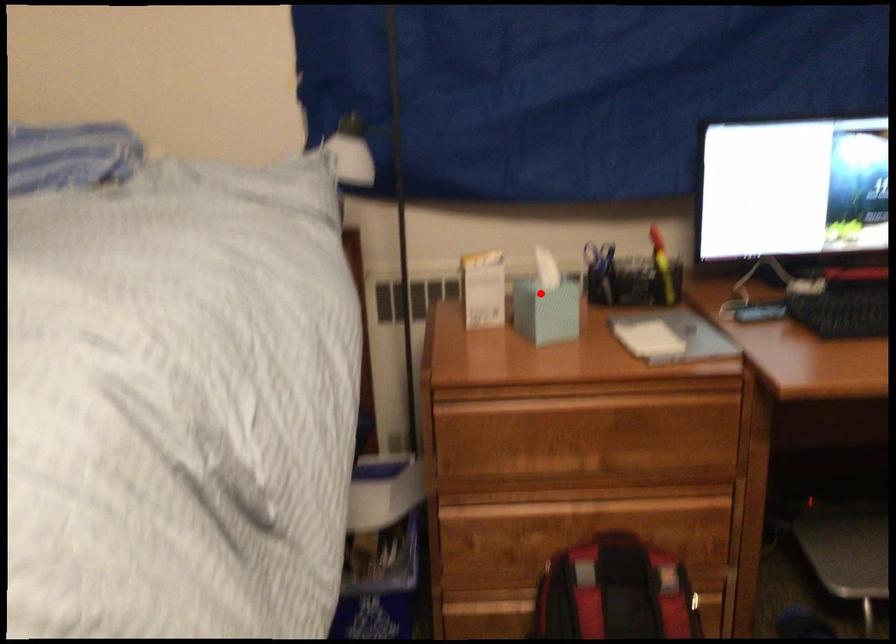
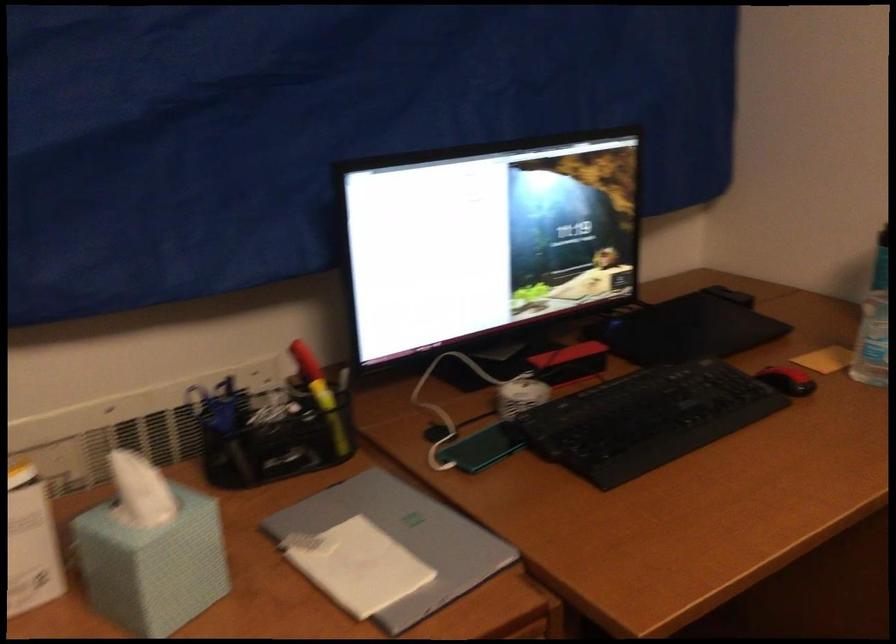
Question: I am providing you with two images of the same scene from different viewpoints. Image1 has a red point marked. In image2, the corresponding 3D location appears at what relative position? Reply with the corresponding letter.

Choices:
 (A) Closer
 (B) Farther

Answer: (A)